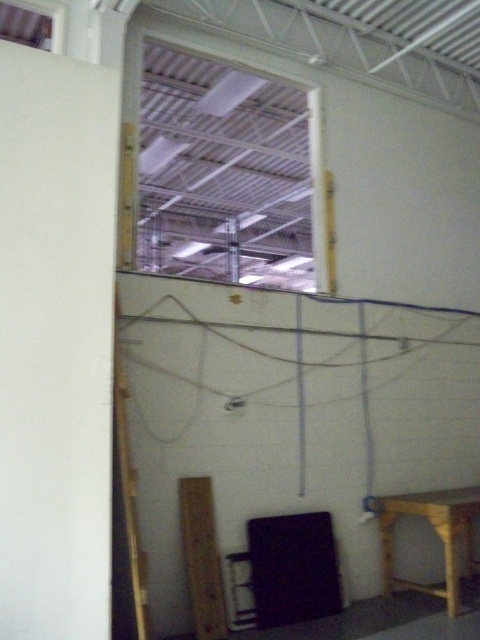
Question: Can you confirm if wooden stool at lower right is positioned to the right of black plastic stool at lower center?

Choices:
 (A) yes
 (B) no

Answer: (A)

Question: Which object is farther from the camera taking this photo?

Choices:
 (A) wooden stool at lower right
 (B) wooden at left

Answer: (A)

Question: Among these objects, which one is farthest from the camera?

Choices:
 (A) wooden at left
 (B) wooden stool at lower right

Answer: (B)

Question: Based on their relative distances, which object is nearer to the black plastic stool at lower center?

Choices:
 (A) wooden stool at lower right
 (B) wooden at left

Answer: (B)

Question: Does wooden stool at lower right have a greater width compared to black plastic stool at lower center?

Choices:
 (A) no
 (B) yes

Answer: (B)

Question: Can you confirm if wooden at left is wider than black plastic stool at lower center?

Choices:
 (A) yes
 (B) no

Answer: (A)